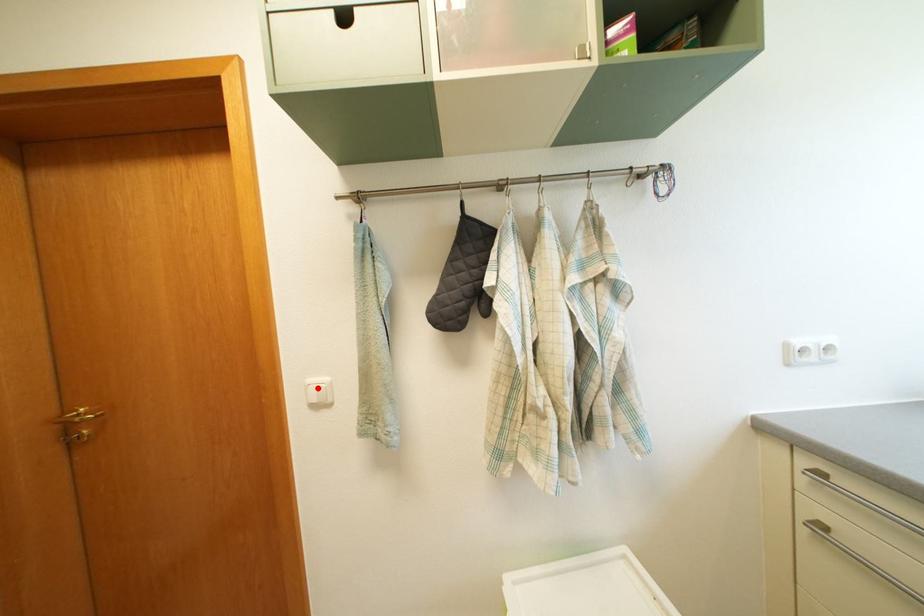
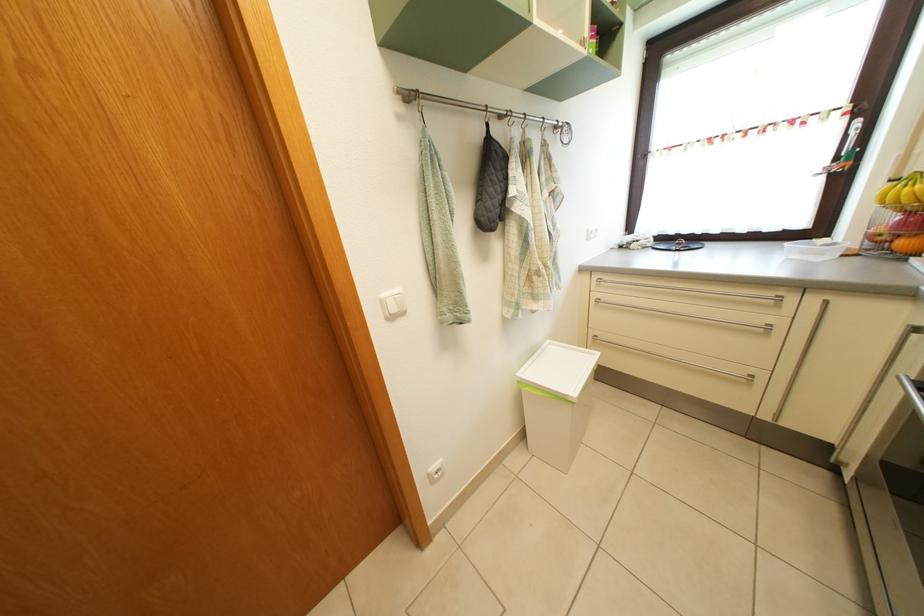
The point at the highlighted location is marked in the first image. Where is the corresponding point in the second image?

(392, 302)